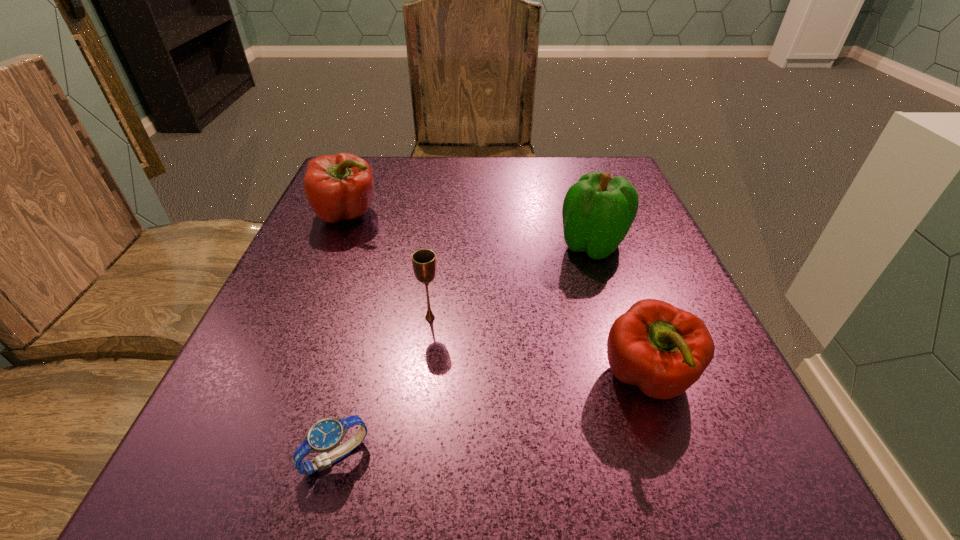
The height and width of the screenshot is (540, 960). I want to click on vacant area that lies between the leftmost bell pepper and the watch, so click(x=342, y=335).

The image size is (960, 540). I want to click on free space between the nearest object and the leftmost bell pepper, so click(x=342, y=335).

Find the location of a particular element. object that ranks as the fourth closest to the nearest object is located at coordinates (598, 211).

This screenshot has height=540, width=960. I want to click on object that is the fourth closest to the leftmost bell pepper, so click(663, 350).

Locate an element on the screen. The height and width of the screenshot is (540, 960). the closest bell pepper relative to the third object from right to left is located at coordinates (663, 350).

Identify which bell pepper is the third nearest to the third object from right to left. Please provide its 2D coordinates. Your answer should be formatted as a tuple, i.e. [(x, y)], where the tuple contains the x and y coordinates of a point satisfying the conditions above.

[(339, 187)]

Locate an element on the screen. blank space that satisfies the following two spatial constraints: 1. on the back side of the watch; 2. on the right side of the chalice is located at coordinates (372, 318).